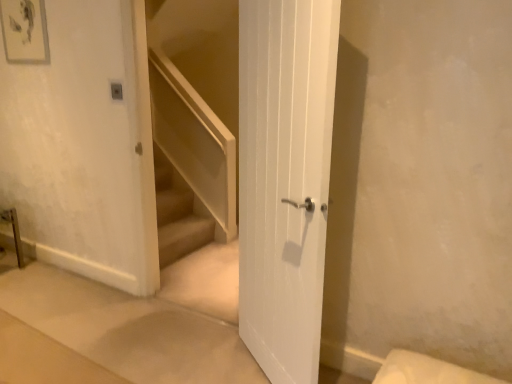
The image size is (512, 384). In order to click on beige carpet at center in this screenshot , I will do `click(127, 329)`.

What do you see at coordinates (127, 329) in the screenshot? I see `beige carpet at center` at bounding box center [127, 329].

Find the location of a particular element. The width and height of the screenshot is (512, 384). beige carpet at center is located at coordinates (127, 329).